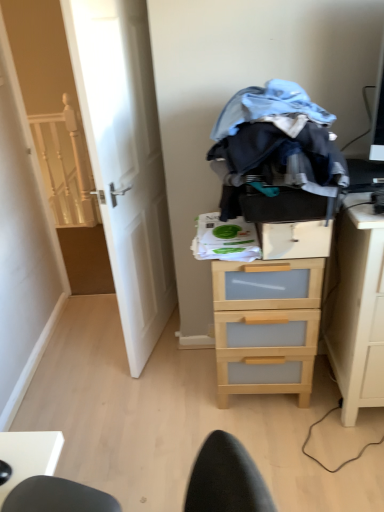
Question: Relative to white wooden door at left, is white wooden stairwell at left in front or behind?

Choices:
 (A) behind
 (B) front

Answer: (A)

Question: Is point (79, 207) positioned closer to the camera than point (153, 208)?

Choices:
 (A) closer
 (B) farther

Answer: (B)

Question: Which object is the farthest from the white wooden door at left?

Choices:
 (A) wooden drawer at center
 (B) denim fabric clothes at center
 (C) white wooden stairwell at left
 (D) light wood/transparent drawer at right
 (E) light wood/transparent drawer at center

Answer: (C)

Question: Considering the real-world distances, which object is closest to the light wood/transparent drawer at center?

Choices:
 (A) wooden drawer at center
 (B) denim fabric clothes at center
 (C) white wooden door at left
 (D) white wooden stairwell at left
 (E) light wood/transparent drawer at right

Answer: (E)